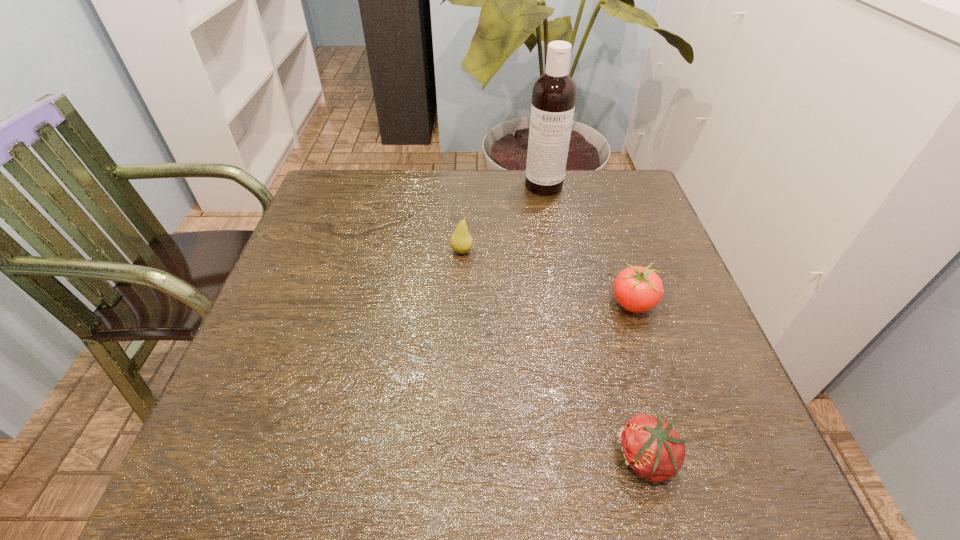
The image size is (960, 540). Find the location of `vacant region at the near left corner of the desktop`. vacant region at the near left corner of the desktop is located at coordinates (252, 493).

The image size is (960, 540). Find the location of `vacant area at the far right corner`. vacant area at the far right corner is located at coordinates (632, 185).

I want to click on vacant space that is in between the farthest object and the shortest object, so click(595, 322).

What are the coordinates of `free space that is in between the shortest object and the dishwasher detergent` in the screenshot? It's located at (595, 322).

The image size is (960, 540). In order to click on free space that is in between the farthest object and the nearer tomato in this screenshot , I will do `click(595, 322)`.

Find the location of a particular element. unoccupied area between the pear and the nearer tomato is located at coordinates (554, 355).

This screenshot has width=960, height=540. What are the coordinates of `vacant space in between the nearer tomato and the taller tomato` in the screenshot? It's located at (639, 381).

Where is `vacant point located between the third tallest object and the leftmost object`? vacant point located between the third tallest object and the leftmost object is located at coordinates (546, 278).

The image size is (960, 540). I want to click on empty location between the tallest object and the pear, so click(503, 218).

The width and height of the screenshot is (960, 540). Identify the location of empty space between the pear and the tallest object. (503, 218).